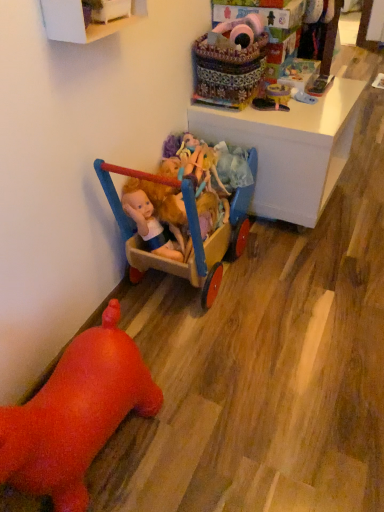
Where is `vacant area that is situated to the right of matte plastic toy at upper center, which appears as the second toy when viewed from the top`? vacant area that is situated to the right of matte plastic toy at upper center, which appears as the second toy when viewed from the top is located at coordinates (324, 104).